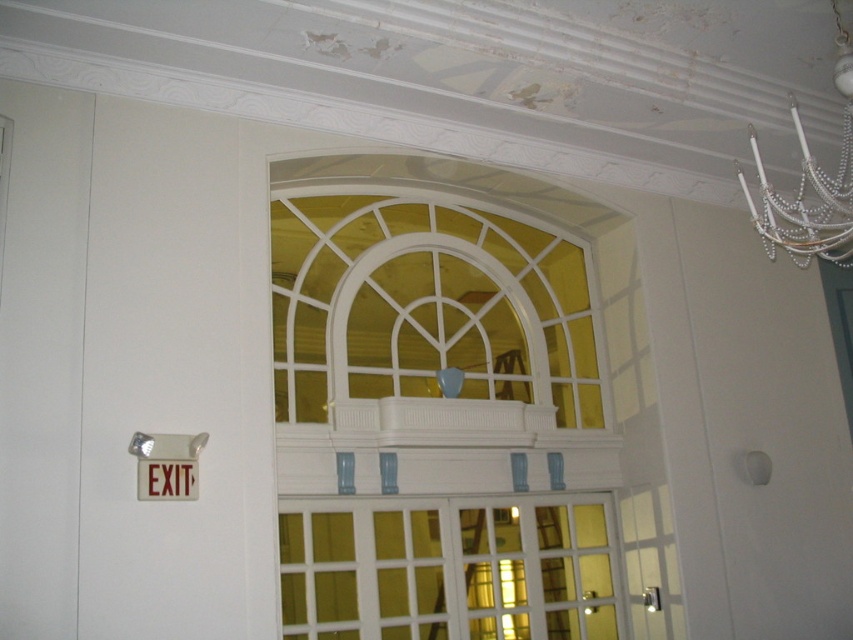
Locate an element on the screen. Image resolution: width=853 pixels, height=640 pixels. pearl white chandelier at upper right is located at coordinates (810, 186).

Is pearl white chandelier at upper right positioned in front of red plastic exit sign at upper left?

That is True.

Where is `pearl white chandelier at upper right`? Image resolution: width=853 pixels, height=640 pixels. pearl white chandelier at upper right is located at coordinates (810, 186).

Measure the distance from white glass door at center to red plastic exit sign at upper left.

1.32 meters

Is point (364, 520) less distant than point (175, 467)?

No, it is behind (175, 467).

What do you see at coordinates (447, 568) in the screenshot?
I see `white glass door at center` at bounding box center [447, 568].

Locate an element on the screen. The width and height of the screenshot is (853, 640). white glass door at center is located at coordinates (447, 568).

Measure the distance from white glass door at center to pearl white chandelier at upper right.

They are 2.35 meters apart.

Does white glass door at center lie in front of pearl white chandelier at upper right?

No, white glass door at center is behind pearl white chandelier at upper right.

Between point (368, 573) and point (813, 177), which one is positioned in front?

Point (813, 177) is in front.

Identify the location of white glass door at center. This screenshot has height=640, width=853. (447, 568).